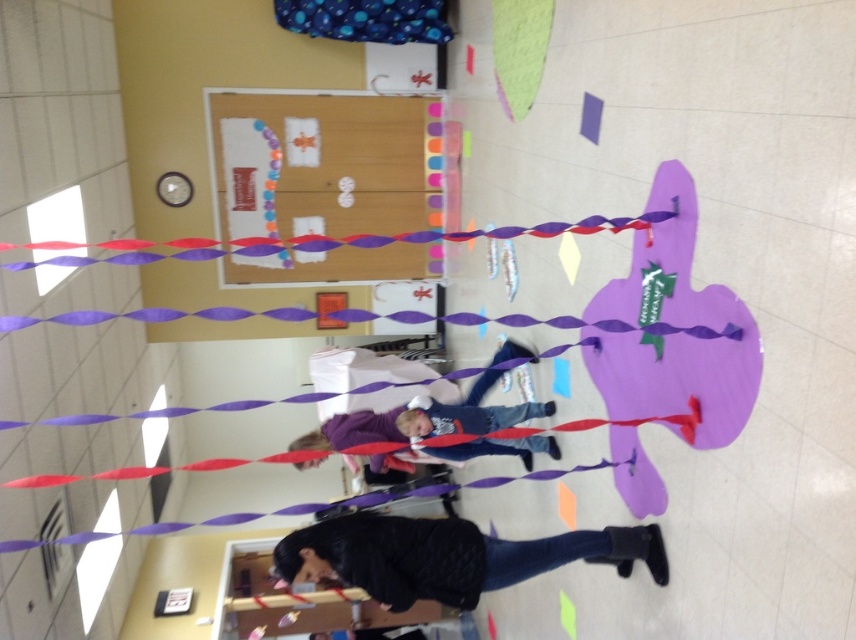
Question: Does matte cardboard bulletin board at upper center have a smaller size compared to black textured jacket at lower center?

Choices:
 (A) yes
 (B) no

Answer: (B)

Question: Does matte cardboard bulletin board at upper center appear on the right side of black textured jacket at lower center?

Choices:
 (A) yes
 (B) no

Answer: (B)

Question: Which of the following is the farthest from the observer?

Choices:
 (A) (254, 216)
 (B) (300, 541)

Answer: (A)

Question: Is the position of matte cardboard bulletin board at upper center less distant than that of black textured jacket at lower center?

Choices:
 (A) no
 (B) yes

Answer: (A)

Question: Which point appears farthest from the camera in this image?

Choices:
 (A) (373, 145)
 (B) (503, 548)

Answer: (A)